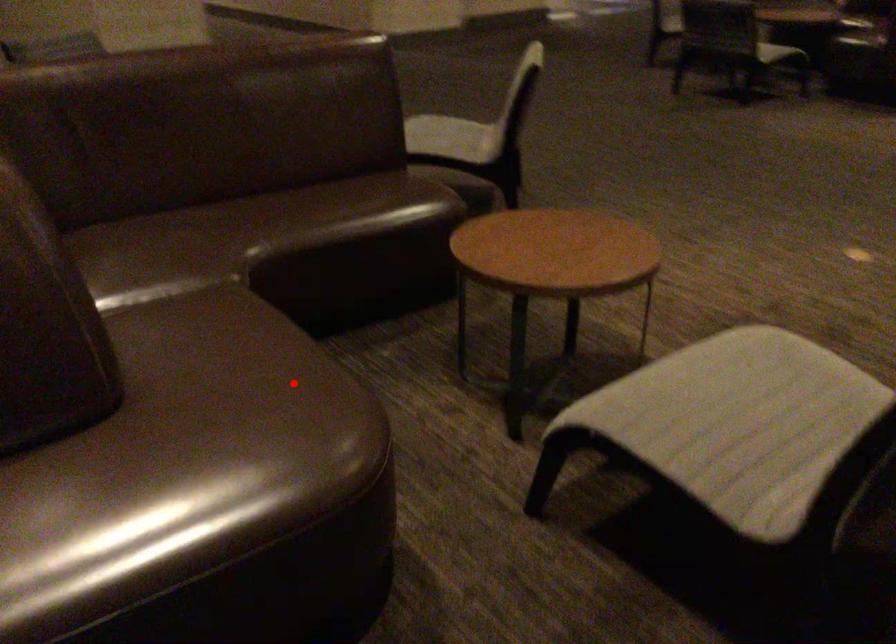
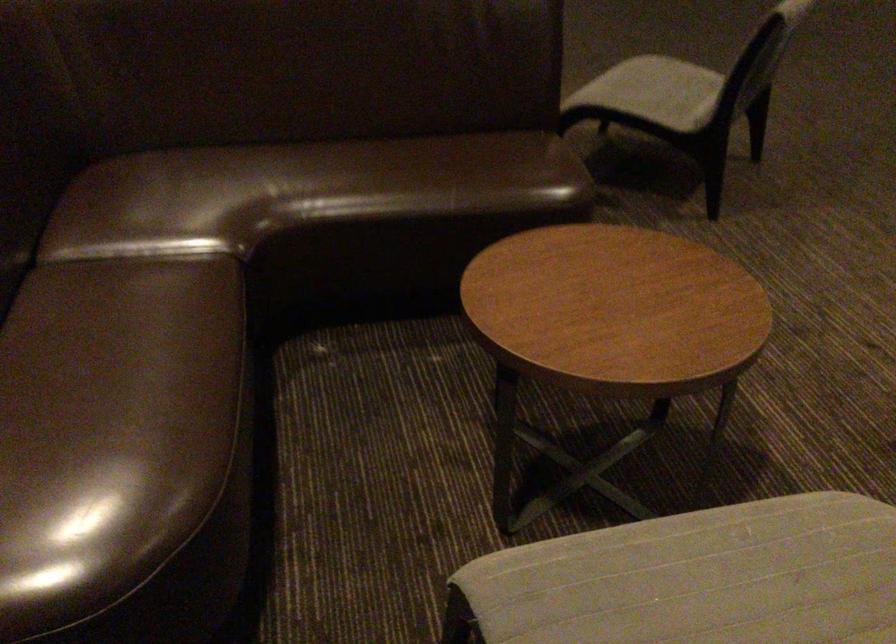
Locate, in the second image, the point that corresponds to the highlighted location in the first image.

(112, 426)